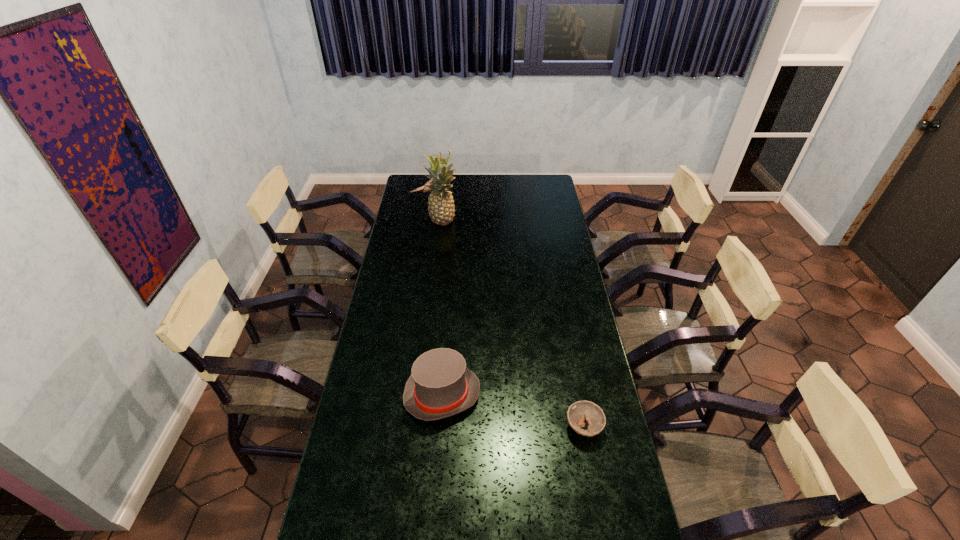
The image size is (960, 540). In order to click on object located in the far edge section of the desktop in this screenshot , I will do `click(426, 189)`.

Where is `pineapple positioned at the left edge`? pineapple positioned at the left edge is located at coordinates (441, 208).

Find the location of a particular element. Image resolution: width=960 pixels, height=540 pixels. bird present at the left edge is located at coordinates (426, 189).

The height and width of the screenshot is (540, 960). I want to click on object that is positioned at the right edge, so click(x=579, y=411).

Locate an element on the screen. The height and width of the screenshot is (540, 960). object situated at the far left corner is located at coordinates (426, 189).

What are the coordinates of `blank space at the left edge of the desktop` in the screenshot? It's located at (345, 536).

In the image, there is a desktop. At what (x,y) coordinates should I click in order to perform the action: click on vacant space at the right edge. Please return your answer as a coordinate pair (x, y). This screenshot has width=960, height=540. Looking at the image, I should click on (564, 312).

The width and height of the screenshot is (960, 540). I want to click on vacant space at the far right corner of the desktop, so click(x=552, y=190).

You are a GUI agent. You are given a task and a screenshot of the screen. Output one action in this format:
    pyautogui.click(x=<x>, y=<y>)
    Task: Click on the vacant space that's between the pineapple and the rightmost object
    
    Given the screenshot: What is the action you would take?
    pyautogui.click(x=514, y=324)

You are a GUI agent. You are given a task and a screenshot of the screen. Output one action in this format:
    pyautogui.click(x=<x>, y=<y>)
    Task: Click on the blank region between the shortest object and the second farthest object
    
    Given the screenshot: What is the action you would take?
    pyautogui.click(x=514, y=324)